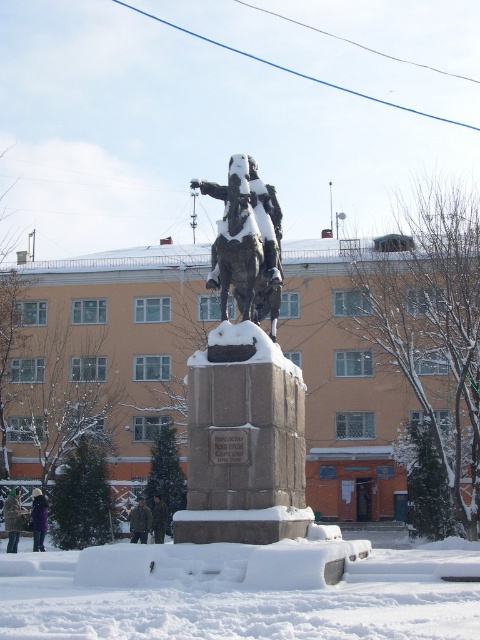
Question: Which point is closer to the camera?

Choices:
 (A) purple fuzzy jacket at lower left
 (B) dark green fur coat at lower left
 (C) sculpted bronze horseman at center

Answer: (C)

Question: Does bronze statue at center have a lesser width compared to purple fuzzy jacket at lower left?

Choices:
 (A) yes
 (B) no

Answer: (B)

Question: Is dark green fur coat at lower left thinner than purple fuzzy jacket at lower left?

Choices:
 (A) no
 (B) yes

Answer: (A)

Question: Which point is closer to the camera?

Choices:
 (A) sculpted bronze horseman at center
 (B) camouflage uniform at center
 (C) purple fuzzy jacket at lower left

Answer: (A)

Question: Which of these objects is positioned closest to the white fluffy snow at lower center?

Choices:
 (A) sculpted bronze horseman at center
 (B) brown woolen jacket at lower center

Answer: (A)

Question: Is dark green fur coat at lower left behind brown woolen jacket at lower center?

Choices:
 (A) no
 (B) yes

Answer: (A)